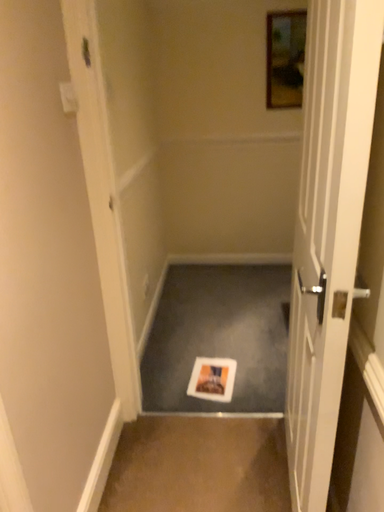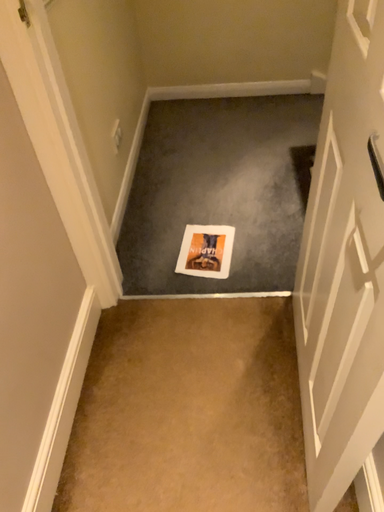
Question: How did the camera likely rotate when shooting the video?

Choices:
 (A) rotated downward
 (B) rotated upward

Answer: (A)